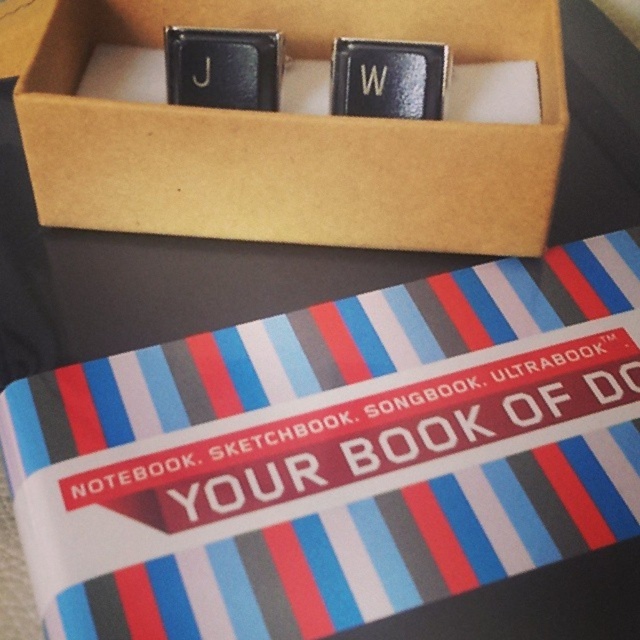
Does striped paper notebook at center have a larger size compared to brown cardboard box at upper center?

Yes, striped paper notebook at center is bigger than brown cardboard box at upper center.

Does striped paper notebook at center have a smaller size compared to brown cardboard box at upper center?

Actually, striped paper notebook at center might be larger than brown cardboard box at upper center.

Is point (384, 532) positioned after point (68, 168)?

No, it is in front of (68, 168).

Find the location of `striped paper notebook at center`. striped paper notebook at center is located at coordinates (336, 454).